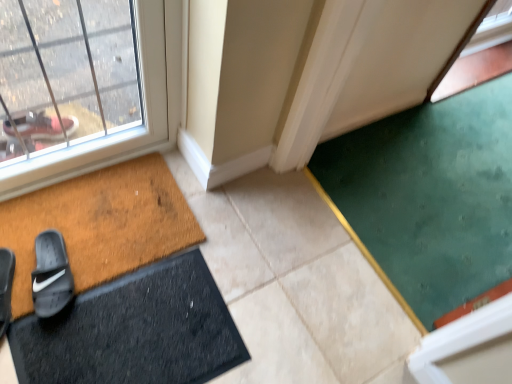
Where is `free space to the right of black rubber bath mat at lower left, positioned as the first bath mat in bottom-to-top order`? free space to the right of black rubber bath mat at lower left, positioned as the first bath mat in bottom-to-top order is located at coordinates (296, 318).